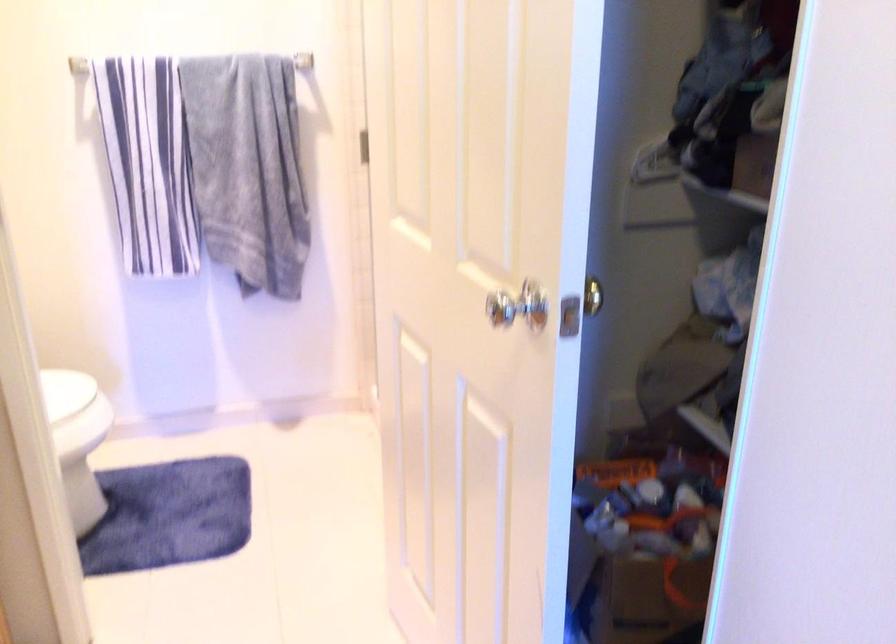
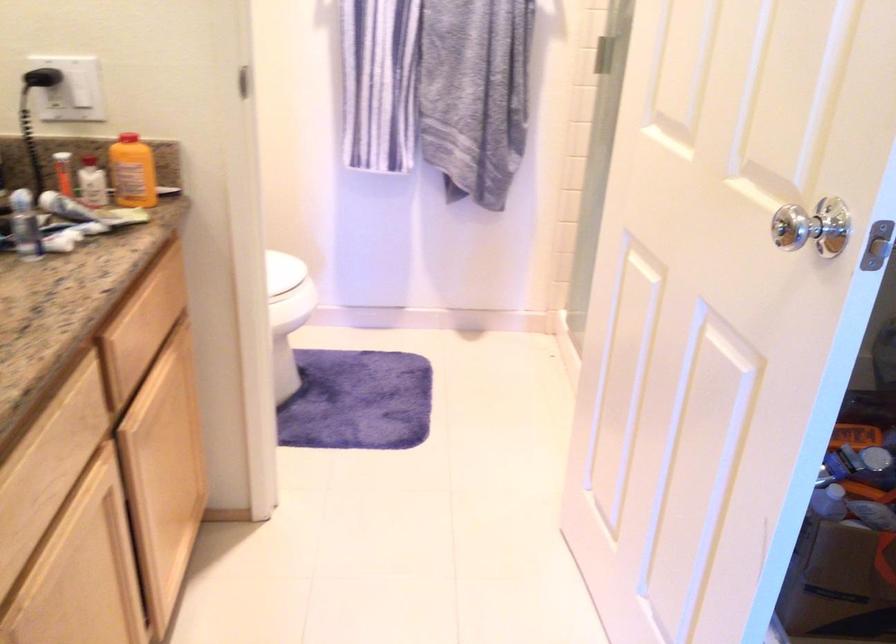
Find the pixel in the second image that matches point 74,390 in the first image.

(282, 270)